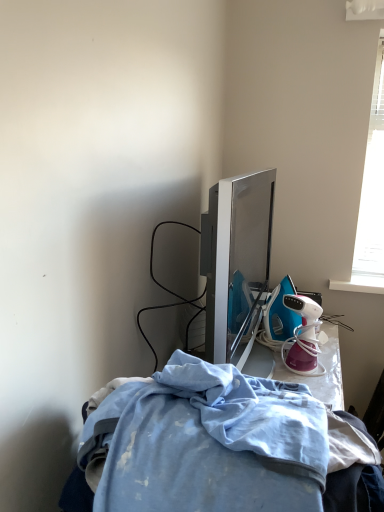
Locate an element on the screen. The height and width of the screenshot is (512, 384). light blue fabric at lower center is located at coordinates (186, 445).

What do you see at coordinates (186, 445) in the screenshot?
I see `light blue fabric at lower center` at bounding box center [186, 445].

Where is `pink glossy garment steamer at right`? This screenshot has height=512, width=384. pink glossy garment steamer at right is located at coordinates (303, 336).

This screenshot has height=512, width=384. Describe the element at coordinates (303, 336) in the screenshot. I see `pink glossy garment steamer at right` at that location.

At what (x,y) coordinates should I click in order to perform the action: click on light blue fabric at lower center. Please return your answer as a coordinate pair (x, y). Looking at the image, I should click on (186, 445).

Does light blue fabric at lower center appear on the right side of pink glossy garment steamer at right?

No, light blue fabric at lower center is not to the right of pink glossy garment steamer at right.

Considering their positions, is light blue fabric at lower center located in front of or behind pink glossy garment steamer at right?

light blue fabric at lower center is positioned closer to the viewer than pink glossy garment steamer at right.

Considering the points (200, 444) and (311, 361), which point is in front, point (200, 444) or point (311, 361)?

Point (200, 444)

From the image's perspective, which one is positioned lower, light blue fabric at lower center or pink glossy garment steamer at right?

From the image's view, light blue fabric at lower center is below.

From a real-world perspective, is light blue fabric at lower center physically located above or below pink glossy garment steamer at right?

From a real-world perspective, light blue fabric at lower center is physically above pink glossy garment steamer at right.

Which object is wider, light blue fabric at lower center or pink glossy garment steamer at right?

Wider between the two is light blue fabric at lower center.

Considering the sizes of light blue fabric at lower center and pink glossy garment steamer at right in the image, is light blue fabric at lower center taller or shorter than pink glossy garment steamer at right?

Clearly, light blue fabric at lower center is taller compared to pink glossy garment steamer at right.

Considering the relative sizes of light blue fabric at lower center and pink glossy garment steamer at right in the image provided, is light blue fabric at lower center bigger than pink glossy garment steamer at right?

Yes.

Is light blue fabric at lower center spatially inside pink glossy garment steamer at right, or outside of it?

light blue fabric at lower center is spatially situated outside pink glossy garment steamer at right.

Is light blue fabric at lower center positioned far away from pink glossy garment steamer at right?

No, there isn't a large distance between light blue fabric at lower center and pink glossy garment steamer at right.

Is pink glossy garment steamer at right at the back of light blue fabric at lower center?

light blue fabric at lower center does not have its back to pink glossy garment steamer at right.

Where is `toy located behind the light blue fabric at lower center`? This screenshot has width=384, height=512. toy located behind the light blue fabric at lower center is located at coordinates (303, 336).

Is pink glossy garment steamer at right at the left side of light blue fabric at lower center?

Incorrect, pink glossy garment steamer at right is not on the left side of light blue fabric at lower center.

From the picture: Does pink glossy garment steamer at right lie behind light blue fabric at lower center?

Yes.

Considering the positions of point (293, 341) and point (225, 477), is point (293, 341) closer or farther from the camera than point (225, 477)?

Point (293, 341) is farther from the camera than point (225, 477).

From the image's perspective, which object appears higher, pink glossy garment steamer at right or light blue fabric at lower center?

pink glossy garment steamer at right.

From a real-world perspective, which is physically above, pink glossy garment steamer at right or light blue fabric at lower center?

light blue fabric at lower center.

Does pink glossy garment steamer at right have a greater width compared to light blue fabric at lower center?

Incorrect, the width of pink glossy garment steamer at right does not surpass that of light blue fabric at lower center.

Is pink glossy garment steamer at right shorter than light blue fabric at lower center?

Correct, pink glossy garment steamer at right is not as tall as light blue fabric at lower center.

Considering the sizes of objects pink glossy garment steamer at right and light blue fabric at lower center in the image provided, who is smaller, pink glossy garment steamer at right or light blue fabric at lower center?

Smaller between the two is pink glossy garment steamer at right.

Is light blue fabric at lower center surrounded by pink glossy garment steamer at right?

No, light blue fabric at lower center is not surrounded by pink glossy garment steamer at right.

Is pink glossy garment steamer at right far away from light blue fabric at lower center?

No.

Is pink glossy garment steamer at right positioned with its back to light blue fabric at lower center?

No, pink glossy garment steamer at right's orientation is not away from light blue fabric at lower center.

How many degrees apart are the facing directions of pink glossy garment steamer at right and light blue fabric at lower center?

The angular difference between pink glossy garment steamer at right and light blue fabric at lower center is 0.487 degrees.

How distant is pink glossy garment steamer at right from light blue fabric at lower center?

pink glossy garment steamer at right is 33.58 inches from light blue fabric at lower center.

The height and width of the screenshot is (512, 384). Identify the location of toy located behind the light blue fabric at lower center. pyautogui.click(x=303, y=336).

This screenshot has height=512, width=384. Identify the location of toy that is behind the light blue fabric at lower center. (303, 336).

This screenshot has height=512, width=384. What are the coordinates of `furniture in front of the pink glossy garment steamer at right` in the screenshot? It's located at (186, 445).